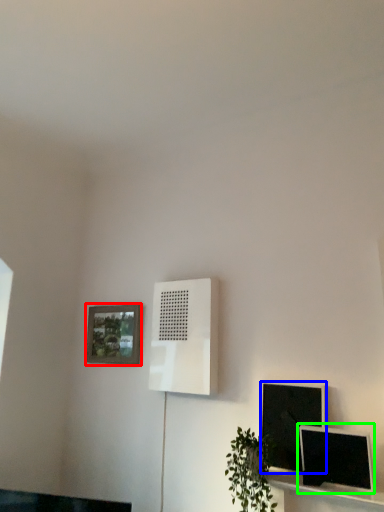
Question: Considering the real-world distances, which object is closest to picture frame (highlighted by a red box)? computer monitor (highlighted by a blue box) or computer monitor (highlighted by a green box).

Choices:
 (A) computer monitor
 (B) computer monitor

Answer: (A)